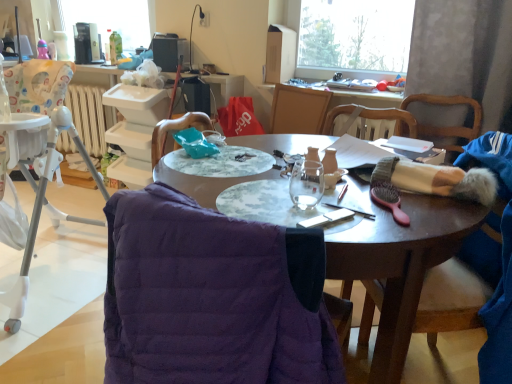
Find the location of `vacant space situated on the left part of black plastic pen at center`. vacant space situated on the left part of black plastic pen at center is located at coordinates (289, 205).